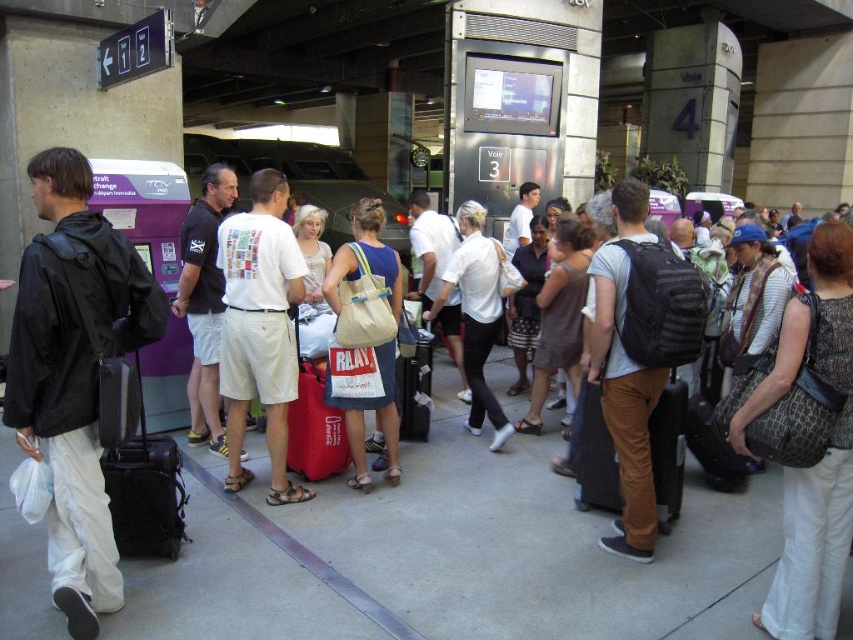
Question: Does white cotton shirt at center have a lesser width compared to brown fabric suitcase at center-right?

Choices:
 (A) no
 (B) yes

Answer: (A)

Question: Which point appears closest to the camera in this image?

Choices:
 (A) (523, 346)
 (B) (668, 456)

Answer: (B)

Question: Among these objects, which one is farthest from the camera?

Choices:
 (A) matte red suitcase at center
 (B) patterned fabric purse at center

Answer: (A)

Question: Which object is the farthest from the white cotton shirt at center?

Choices:
 (A) patterned fabric purse at center
 (B) matte red suitcase at center

Answer: (A)

Question: Does black leather suitcase at left have a lesser width compared to brown fabric dress at center?

Choices:
 (A) yes
 (B) no

Answer: (A)

Question: Considering the relative positions of brown fabric dress at center and red fabric suitcase at center in the image provided, where is brown fabric dress at center located with respect to red fabric suitcase at center?

Choices:
 (A) right
 (B) left

Answer: (A)